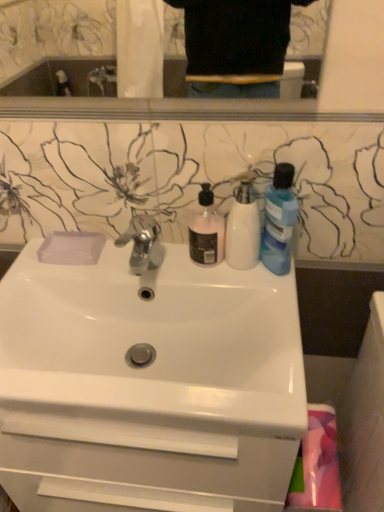
Where is `free space between transparent plastic soap at upper left and polished chrome faucet at center`? This screenshot has height=512, width=384. free space between transparent plastic soap at upper left and polished chrome faucet at center is located at coordinates (94, 266).